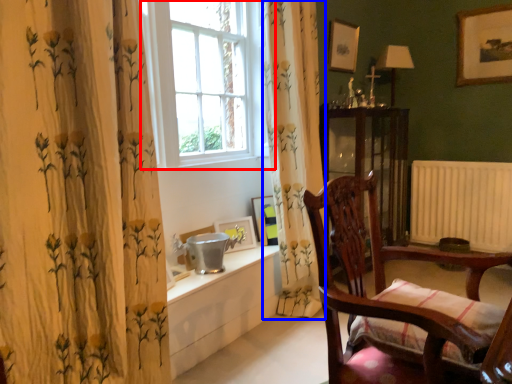
Question: Which object is closer to the camera taking this photo, window (highlighted by a red box) or curtain (highlighted by a blue box)?

Choices:
 (A) window
 (B) curtain

Answer: (A)